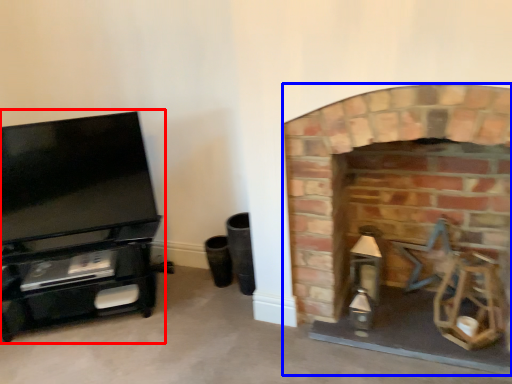
Question: Which point is closer to the camera, entertainment center (highlighted by a red box) or fireplace (highlighted by a blue box)?

Choices:
 (A) entertainment center
 (B) fireplace

Answer: (B)